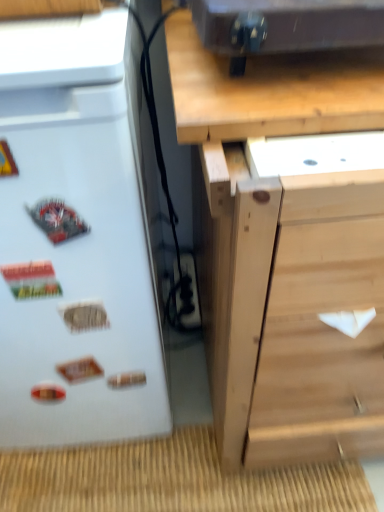
Question: Is natural wood chest of drawers at center at the right side of black plastic electric outlet at lower center?

Choices:
 (A) yes
 (B) no

Answer: (A)

Question: From the image's perspective, does natural wood chest of drawers at center appear higher than black plastic electric outlet at lower center?

Choices:
 (A) yes
 (B) no

Answer: (A)

Question: Considering the relative sizes of natural wood chest of drawers at center and black plastic electric outlet at lower center in the image provided, is natural wood chest of drawers at center smaller than black plastic electric outlet at lower center?

Choices:
 (A) yes
 (B) no

Answer: (B)

Question: From a real-world perspective, is natural wood chest of drawers at center over black plastic electric outlet at lower center?

Choices:
 (A) yes
 (B) no

Answer: (A)

Question: Is natural wood chest of drawers at center positioned before black plastic electric outlet at lower center?

Choices:
 (A) no
 (B) yes

Answer: (B)

Question: Considering the relative positions of black plastic electric outlet at lower center and metallic black speaker at upper center in the image provided, is black plastic electric outlet at lower center to the left or to the right of metallic black speaker at upper center?

Choices:
 (A) right
 (B) left

Answer: (B)

Question: Relative to metallic black speaker at upper center, is black plastic electric outlet at lower center in front or behind?

Choices:
 (A) front
 (B) behind

Answer: (B)

Question: Looking at their shapes, would you say black plastic electric outlet at lower center is wider or thinner than metallic black speaker at upper center?

Choices:
 (A) thin
 (B) wide

Answer: (A)

Question: Considering the positions of point (193, 324) and point (367, 25), is point (193, 324) closer or farther from the camera than point (367, 25)?

Choices:
 (A) farther
 (B) closer

Answer: (A)

Question: Based on their sizes in the image, would you say black plastic electric outlet at lower center is bigger or smaller than natural wood chest of drawers at center?

Choices:
 (A) big
 (B) small

Answer: (B)

Question: Is black plastic electric outlet at lower center situated inside natural wood chest of drawers at center or outside?

Choices:
 (A) inside
 (B) outside

Answer: (A)

Question: Considering the positions of black plastic electric outlet at lower center and natural wood chest of drawers at center in the image, is black plastic electric outlet at lower center wider or thinner than natural wood chest of drawers at center?

Choices:
 (A) thin
 (B) wide

Answer: (A)

Question: Is black plastic electric outlet at lower center in front of or behind natural wood chest of drawers at center in the image?

Choices:
 (A) front
 (B) behind

Answer: (B)

Question: From the image's perspective, relative to white matte refrigerator at left, is metallic black speaker at upper center above or below?

Choices:
 (A) above
 (B) below

Answer: (A)

Question: Is point (281, 5) closer or farther from the camera than point (29, 72)?

Choices:
 (A) farther
 (B) closer

Answer: (A)